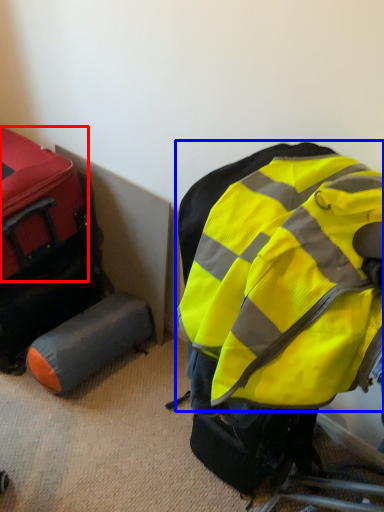
Question: Which of the following is the closest to the observer, luggage (highlighted by a red box) or backpack (highlighted by a blue box)?

Choices:
 (A) luggage
 (B) backpack

Answer: (B)